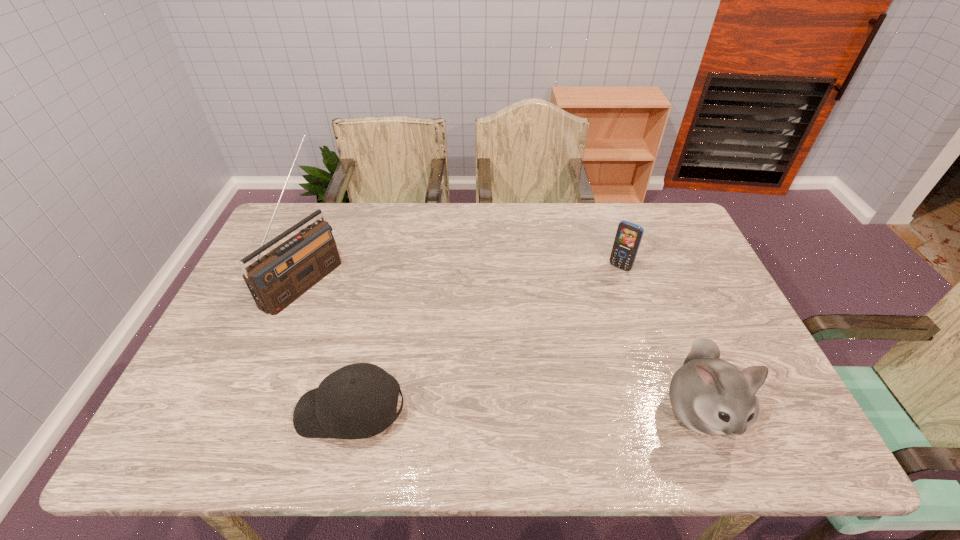
Find the location of a particular element. baseball cap is located at coordinates coord(357,401).

Find the location of `the shortest object`. the shortest object is located at coordinates (357, 401).

Where is `hamster`? hamster is located at coordinates (710, 396).

The image size is (960, 540). Identify the location of the tallest object. (281, 276).

Where is `the leftmost object`? Image resolution: width=960 pixels, height=540 pixels. the leftmost object is located at coordinates (281, 276).

Find the location of a particular element. The image size is (960, 540). the third tallest object is located at coordinates (628, 237).

Identify the location of free space located with a logo on the front of the shortest object. (222, 411).

In order to click on free space located 0.080m with a logo on the front of the shortest object in this screenshot , I will do `click(261, 411)`.

At what (x,y) coordinates should I click in order to perform the action: click on blank area located with a logo on the front of the shortest object. Please return your answer as a coordinate pair (x, y). The image size is (960, 540). Looking at the image, I should click on [x=200, y=411].

Locate an element on the screen. vacant space located on the front-facing side of the leftmost object is located at coordinates (396, 336).